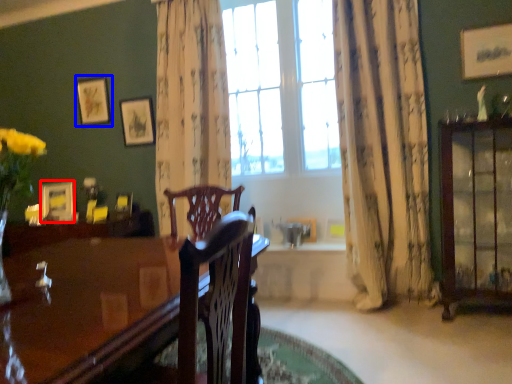
Question: Among these objects, which one is nearest to the camera, picture frame (highlighted by a red box) or picture frame (highlighted by a blue box)?

Choices:
 (A) picture frame
 (B) picture frame

Answer: (A)